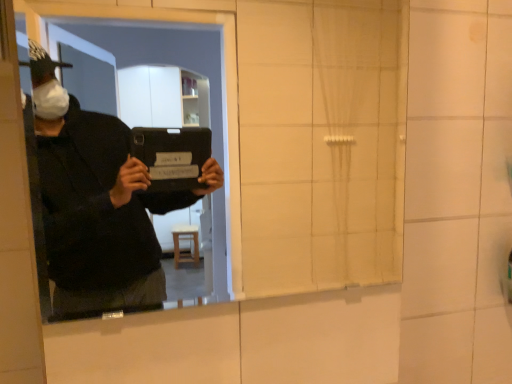
What do you see at coordinates (222, 90) in the screenshot?
I see `white glossy mirror at upper center` at bounding box center [222, 90].

Locate an element on the screen. This screenshot has height=384, width=512. white glossy mirror at upper center is located at coordinates (222, 90).

What are the coordinates of `white glossy mirror at upper center` in the screenshot? It's located at (222, 90).